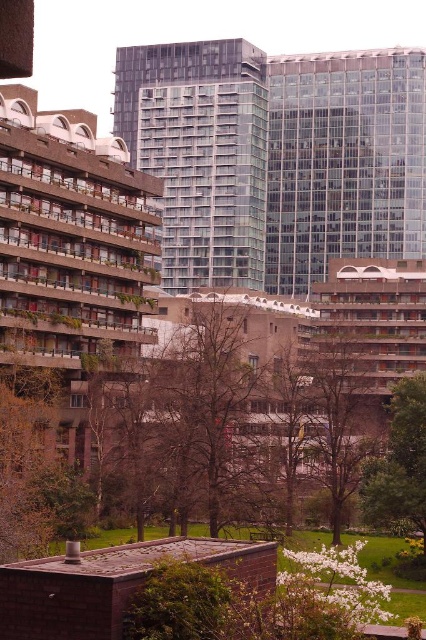
You are standing in the scene and want to determine which of the two points, point (216, 161) or point (328, 488), is closer to you. Based on the image, which point is nearer?

Point (216, 161) is closer to you than point (328, 488) because it is further to the viewer in the image.

You are standing in the park area between the two types of buildings. You see a brown leafless tree at center and a green leafy tree at lower right. Which tree is higher up in the image?

The brown leafless tree at center is above the green leafy tree at lower right in the image.